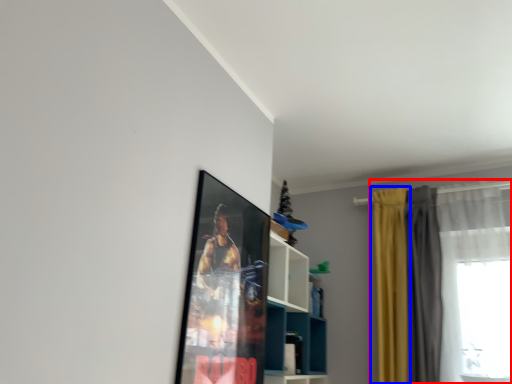
Question: Which point is further to the camera, curtain (highlighted by a red box) or curtain (highlighted by a blue box)?

Choices:
 (A) curtain
 (B) curtain

Answer: (B)